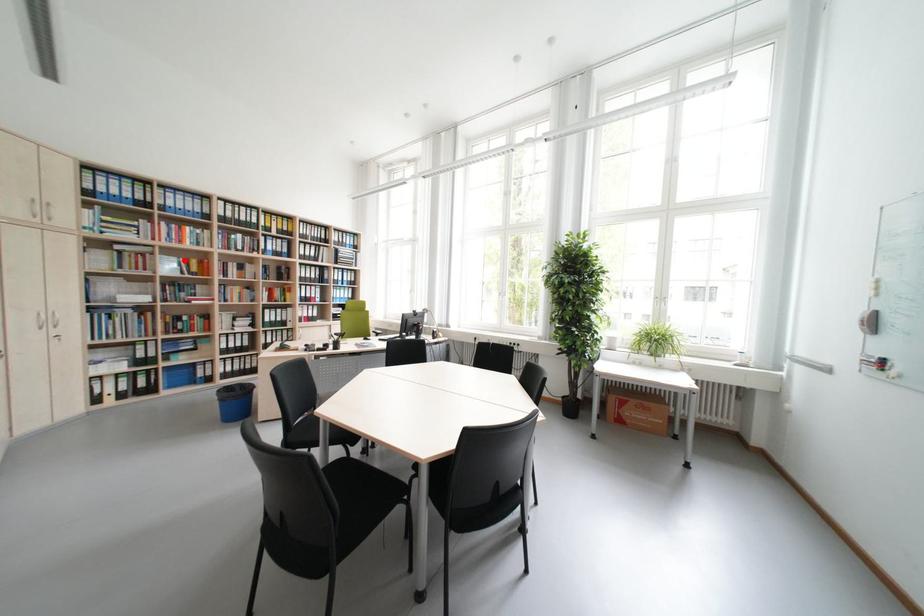
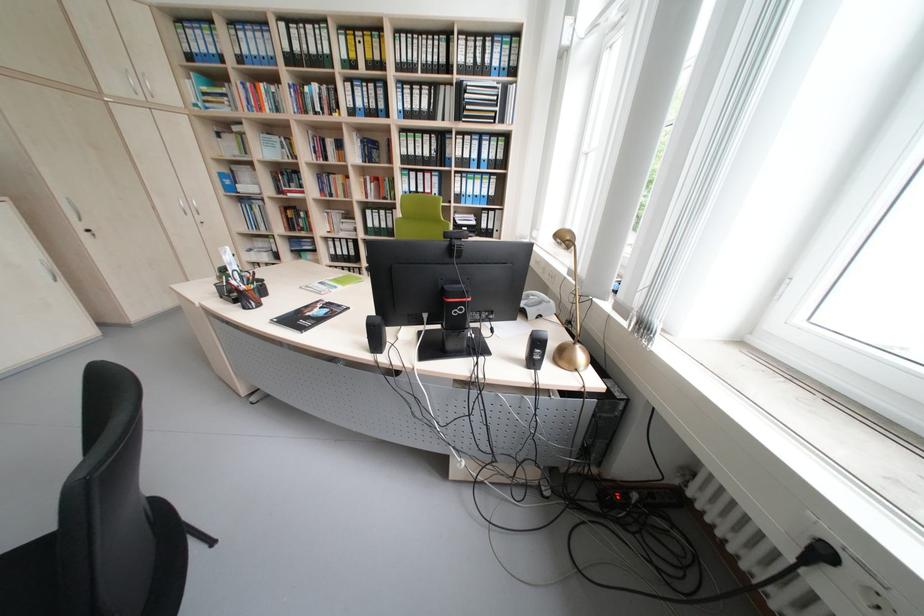
Locate, in the second image, the point that corresponds to the highlighted location in the first image.

(286, 140)